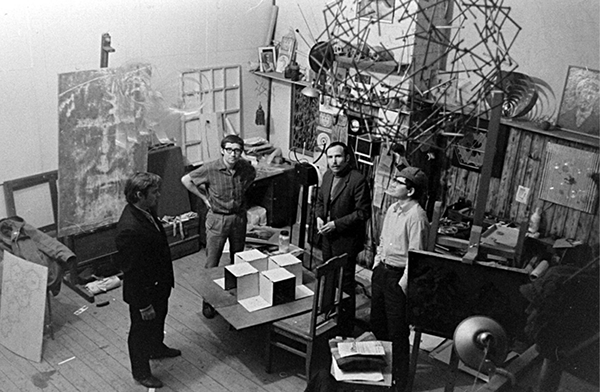
Find the location of `floor`. floor is located at coordinates (209, 357).